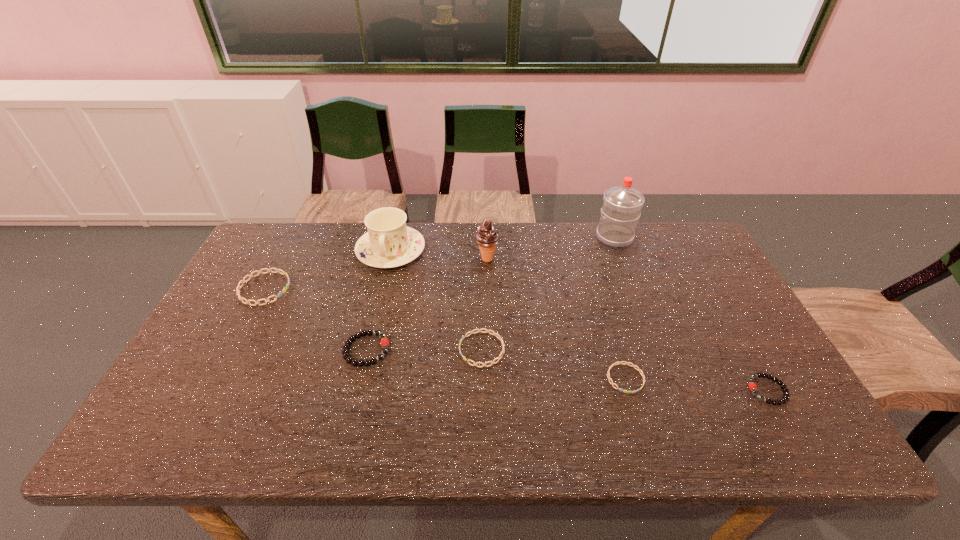
Where is `free point between the fourth bracelet from right to left and the seventh shortest object`? This screenshot has height=540, width=960. free point between the fourth bracelet from right to left and the seventh shortest object is located at coordinates (426, 305).

Locate an element on the screen. empty location between the farthest blue bracelet and the right black bracelet is located at coordinates (516, 340).

Locate an element on the screen. This screenshot has width=960, height=540. empty location between the second tallest object and the rightmost bracelet is located at coordinates (627, 325).

I want to click on vacant area between the bigger black bracelet and the farthest blue bracelet, so click(x=316, y=319).

In order to click on empty space that is in between the second smallest blue bracelet and the farther black bracelet in this screenshot , I will do `click(424, 349)`.

The height and width of the screenshot is (540, 960). I want to click on the sixth closest object to the second tallest object, so click(x=243, y=281).

Locate which object ranks fifth in proximity to the smallest blue bracelet. Please provide its 2D coordinates. Your answer should be formatted as a tuple, i.e. [(x, y)], where the tuple contains the x and y coordinates of a point satisfying the conditions above.

[(384, 342)]

Select which bracelet is the second closest to the rightmost object. Please provide its 2D coordinates. Your answer should be formatted as a tuple, i.e. [(x, y)], where the tuple contains the x and y coordinates of a point satisfying the conditions above.

[(479, 330)]

Where is `bracelet that stands as the closest to the bigger black bracelet`? The width and height of the screenshot is (960, 540). bracelet that stands as the closest to the bigger black bracelet is located at coordinates (479, 330).

You are a GUI agent. You are given a task and a screenshot of the screen. Output one action in this format:
    pyautogui.click(x=<x>, y=<y>)
    Task: Click on the closest blue bracelet to the leftmost blue bracelet
    Image resolution: width=960 pixels, height=540 pixels.
    Given the screenshot: What is the action you would take?
    coord(479,330)